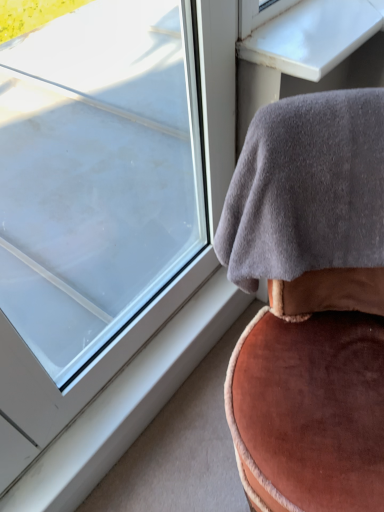
The width and height of the screenshot is (384, 512). Identify the location of vacant space underneath transparent glass window at upper left (from a real-world perspective). (166, 341).